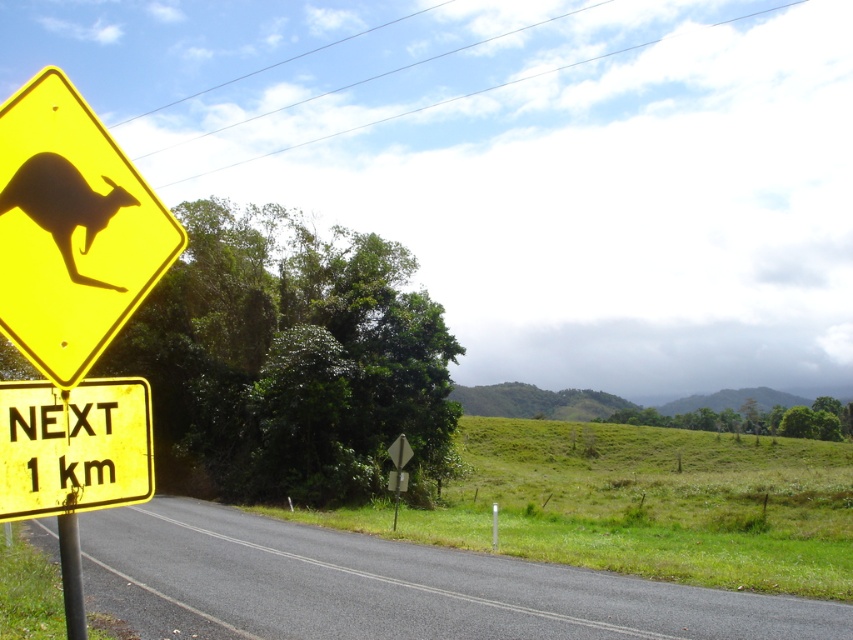
Question: Is yellow plastic kangaroo sign at left behind silhouette paper kangaroo at left?

Choices:
 (A) no
 (B) yes

Answer: (B)

Question: Can you confirm if yellow plastic kangaroo sign at left is smaller than yellow matte sign at lower left?

Choices:
 (A) no
 (B) yes

Answer: (A)

Question: Which of the following is the farthest from the observer?

Choices:
 (A) yellow matte sign at lower left
 (B) yellow plastic kangaroo sign at left
 (C) metallic pole at left
 (D) silhouette paper kangaroo at left

Answer: (C)

Question: Estimate the real-world distances between objects in this image. Which object is farther from the metallic pole at left?

Choices:
 (A) yellow plastic kangaroo sign at left
 (B) silhouette paper kangaroo at left

Answer: (A)

Question: Does yellow plastic kangaroo sign at left have a greater width compared to yellow matte sign at lower left?

Choices:
 (A) no
 (B) yes

Answer: (B)

Question: Based on their relative distances, which object is nearer to the silhouette paper kangaroo at left?

Choices:
 (A) yellow plastic kangaroo sign at left
 (B) metallic pole at left
 (C) yellow matte sign at lower left

Answer: (A)